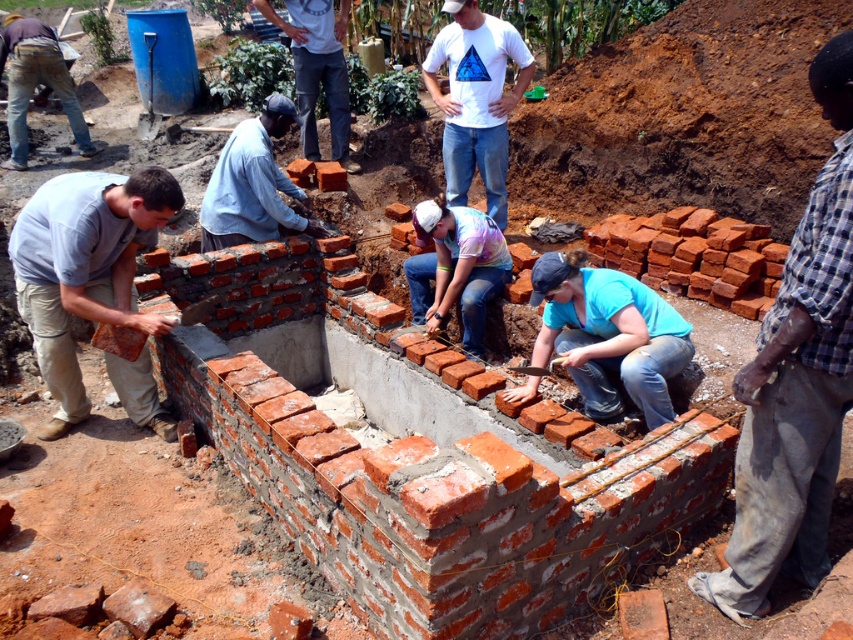
Where is the checkered fabric shirt at right located in the image?

The checkered fabric shirt at right is located at point [796,381] in the image.

You are a construction worker standing at the construction site. You notice a matte gray brick at left and a light blue shirt at center. Which object is taller?

The matte gray brick at left is taller than the light blue shirt at center.